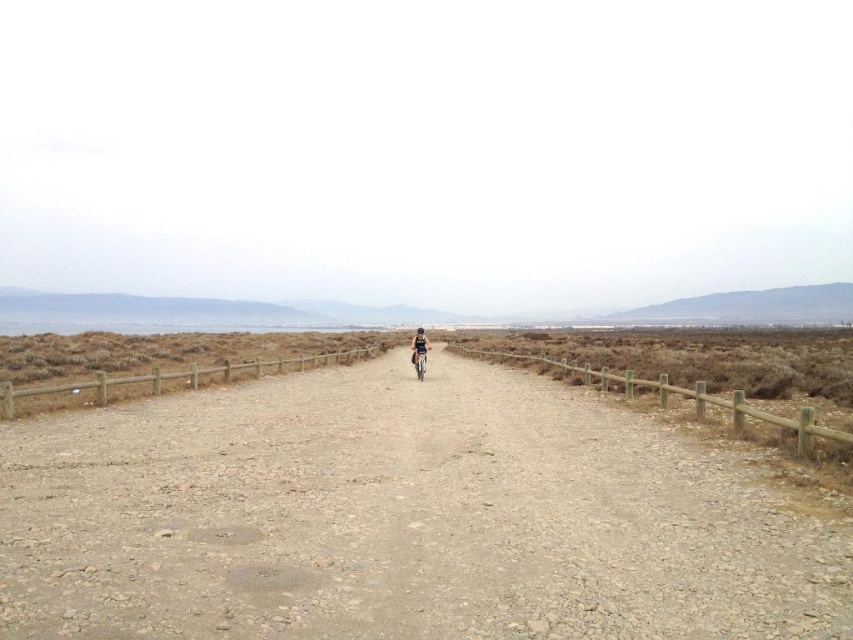
Is brown wooden fence at left to the left of denim shorts at center from the viewer's perspective?

Yes, brown wooden fence at left is to the left of denim shorts at center.

Between point (44, 401) and point (416, 369), which one is positioned behind?

Positioned behind is point (416, 369).

This screenshot has height=640, width=853. Find the location of `brown wooden fence at left`. brown wooden fence at left is located at coordinates (165, 380).

Who is positioned more to the left, wooden fence at right or denim shorts at center?

From the viewer's perspective, denim shorts at center appears more on the left side.

Can you confirm if wooden fence at right is positioned above denim shorts at center?

No, wooden fence at right is not above denim shorts at center.

Is point (701, 408) more distant than point (412, 339)?

No, it is not.

Identify the location of wooden fence at right. (682, 396).

Does wooden fence at right appear on the right side of metallic silver bicycle at center?

Yes, wooden fence at right is to the right of metallic silver bicycle at center.

Is wooden fence at right positioned at the back of metallic silver bicycle at center?

That is False.

Locate an element on the screen. wooden fence at right is located at coordinates (682, 396).